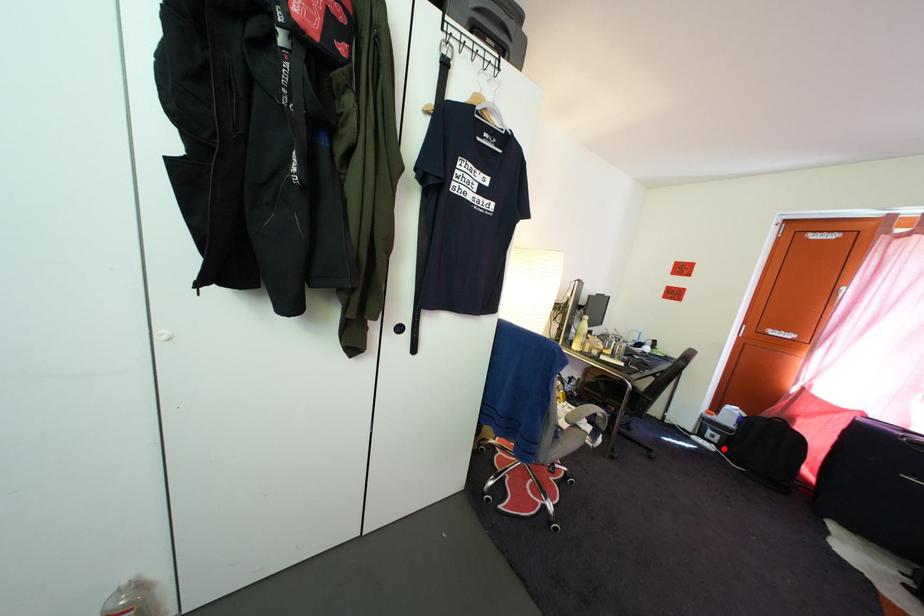
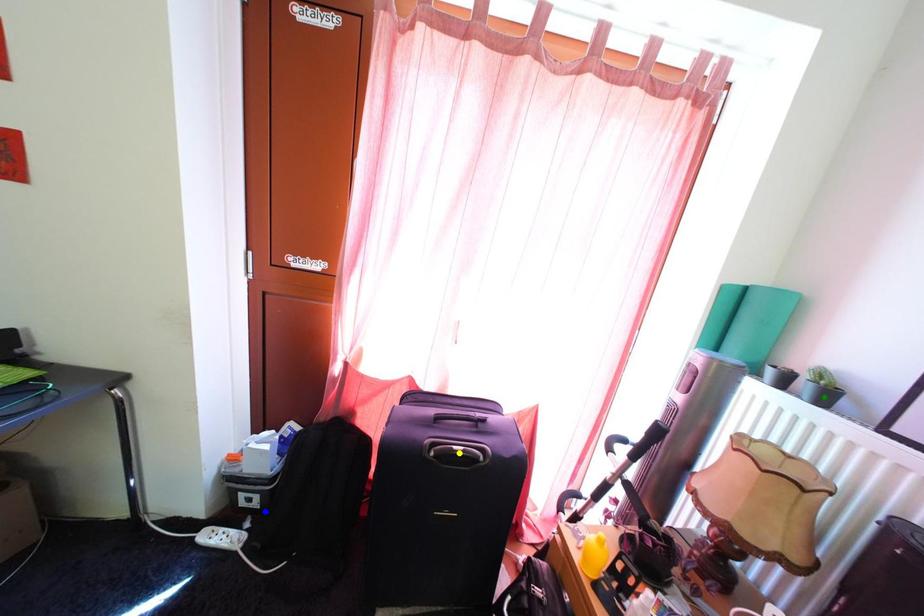
Question: I am providing you with two images of the same scene from different viewpoints. A red point is marked on the first image. You are given multiple points on the second image. Which spot in image 2 lines up with the point in image 1?

Choices:
 (A) green point
 (B) blue point
 (C) yellow point

Answer: (B)